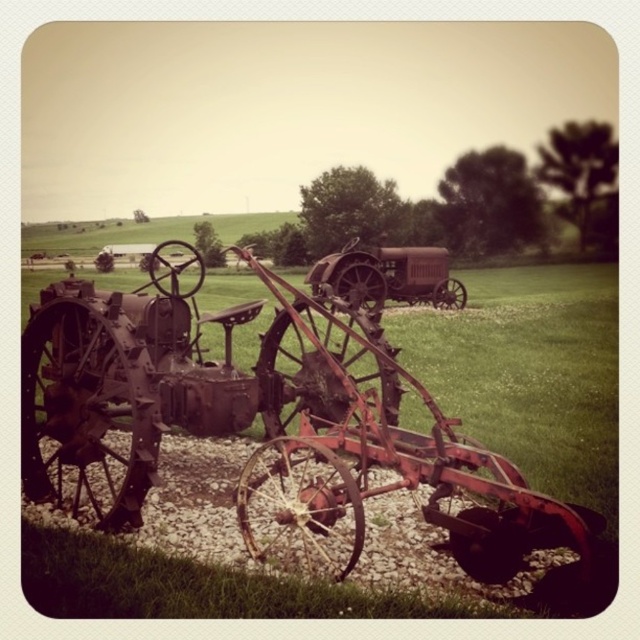
From the picture: You are a farmer assessing the storage space in your barn. You have two rusty metal tractors to store. The rusty metal tractor at left and the rusty metal tractor at center. Given that the barn has a height restriction of 2 meters, can both tractors fit vertically?

The rusty metal tractor at left is taller than the rusty metal tractor at center. Since the barn has a height restriction of 2 meters, we need to know the exact height of the taller tractor. However, the description only states that the left tractor is taller. Without specific measurements, we cannot confirm if both will fit. Please provide the actual heights of both tractors for accurate assessment.

You are standing at the center of the grassy area and want to locate the rusty metal tractor at left. According to the coordinates given, in which direction should you move to find it?

The rusty metal tractor at left is located at coordinates point (266, 426). Since you are at the center, moving towards the left direction will help you find it.